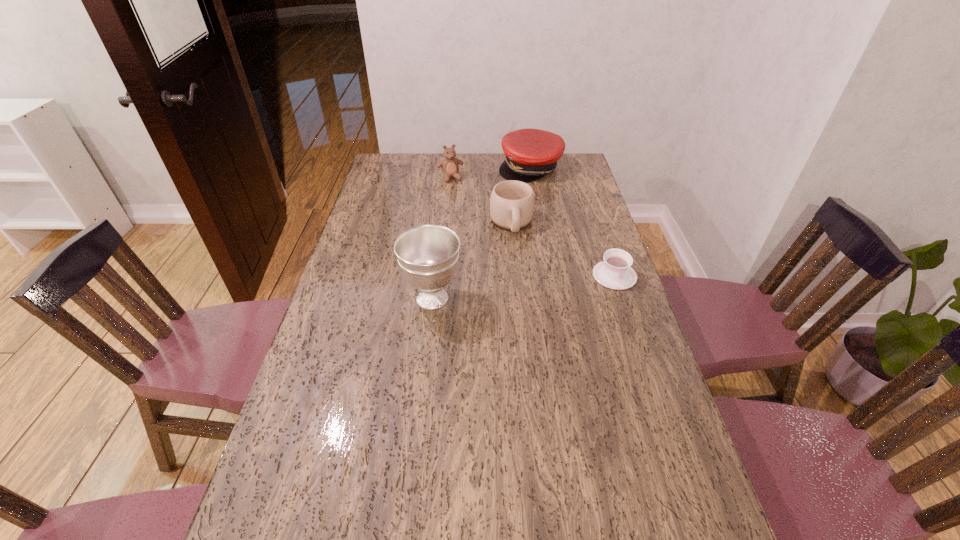
Locate an element on the screen. The width and height of the screenshot is (960, 540). free spot that satisfies the following two spatial constraints: 1. on the back side of the cap; 2. on the left side of the tallest object is located at coordinates (447, 168).

Identify the location of free region that satisfies the following two spatial constraints: 1. on the back side of the teddy bear; 2. on the left side of the cap. The height and width of the screenshot is (540, 960). coord(451,168).